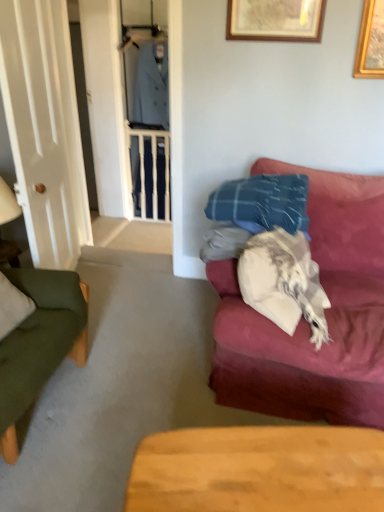
Question: Does wooden table at lower center touch white glossy door at left?

Choices:
 (A) no
 (B) yes

Answer: (A)

Question: Considering the relative positions of wooden table at lower center and white glossy door at left in the image provided, is wooden table at lower center in front of white glossy door at left?

Choices:
 (A) no
 (B) yes

Answer: (B)

Question: Considering the relative sizes of wooden table at lower center and white glossy door at left in the image provided, is wooden table at lower center bigger than white glossy door at left?

Choices:
 (A) no
 (B) yes

Answer: (A)

Question: Can you confirm if wooden table at lower center is shorter than white glossy door at left?

Choices:
 (A) no
 (B) yes

Answer: (B)

Question: Can you confirm if wooden table at lower center is positioned to the left of white glossy door at left?

Choices:
 (A) no
 (B) yes

Answer: (A)

Question: Considering their positions, is velvet red couch at right located in front of or behind wooden table at lower center?

Choices:
 (A) behind
 (B) front

Answer: (A)

Question: Is point [x=380, y=311] positioned closer to the camera than point [x=364, y=439]?

Choices:
 (A) closer
 (B) farther

Answer: (B)

Question: From their relative heights in the image, would you say velvet red couch at right is taller or shorter than wooden table at lower center?

Choices:
 (A) short
 (B) tall

Answer: (B)

Question: From the image's perspective, is velvet red couch at right located above or below wooden table at lower center?

Choices:
 (A) above
 (B) below

Answer: (A)

Question: Based on their positions, is white glossy door at left located to the left or right of wooden table at lower center?

Choices:
 (A) left
 (B) right

Answer: (A)

Question: From a real-world perspective, is white glossy door at left positioned above or below wooden table at lower center?

Choices:
 (A) above
 (B) below

Answer: (A)

Question: Choose the correct answer: Is white glossy door at left inside wooden table at lower center or outside it?

Choices:
 (A) outside
 (B) inside

Answer: (A)

Question: From their relative heights in the image, would you say white glossy door at left is taller or shorter than wooden table at lower center?

Choices:
 (A) tall
 (B) short

Answer: (A)

Question: Is point (370, 458) positioned closer to the camera than point (241, 382)?

Choices:
 (A) farther
 (B) closer

Answer: (B)

Question: Is wooden table at lower center to the left or to the right of velvet red couch at right in the image?

Choices:
 (A) left
 (B) right

Answer: (A)